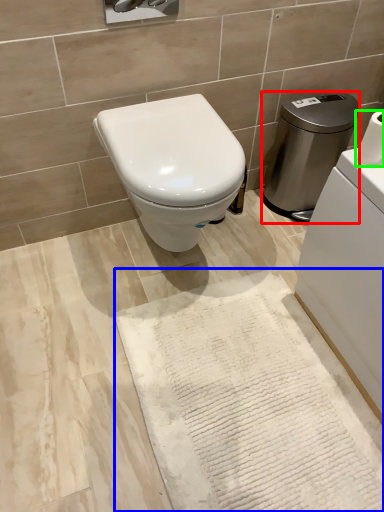
Question: Estimate the real-world distances between objects in this image. Which object is closer to water heater (highlighted by a red box), bath mat (highlighted by a blue box) or toilet paper (highlighted by a green box)?

Choices:
 (A) bath mat
 (B) toilet paper

Answer: (B)